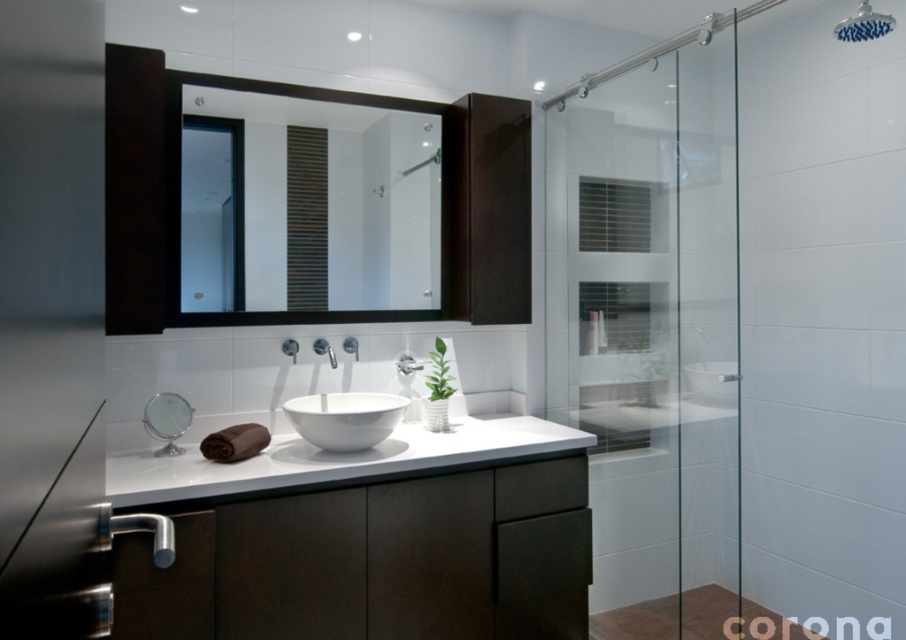
Is transparent glass shower door at right shorter than white glossy faucet at center?

In fact, transparent glass shower door at right may be taller than white glossy faucet at center.

Is point (622, 620) behind point (407, 358)?

That is True.

Measure the distance between transparent glass shower door at right and camera.

transparent glass shower door at right is 6.99 feet from camera.

Image resolution: width=906 pixels, height=640 pixels. Find the location of `transparent glass shower door at right`. transparent glass shower door at right is located at coordinates 651,333.

Can you confirm if black matte mirror at upper center is wider than white glossy faucet at center?

Indeed, black matte mirror at upper center has a greater width compared to white glossy faucet at center.

Who is shorter, black matte mirror at upper center or white glossy faucet at center?

white glossy faucet at center

At what (x,y) coordinates should I click in order to perform the action: click on black matte mirror at upper center. Please return your answer as a coordinate pair (x, y). Looking at the image, I should click on (301, 204).

Is point (357, 440) farther from viewer compared to point (859, 35)?

Yes, point (357, 440) is behind point (859, 35).

Can you confirm if white glossy bowl at center is positioned to the left of blue fabric shower head at upper center?

Indeed, white glossy bowl at center is positioned on the left side of blue fabric shower head at upper center.

Locate an element on the screen. white glossy bowl at center is located at coordinates (345, 419).

Identify the location of white glossy bowl at center. 345,419.